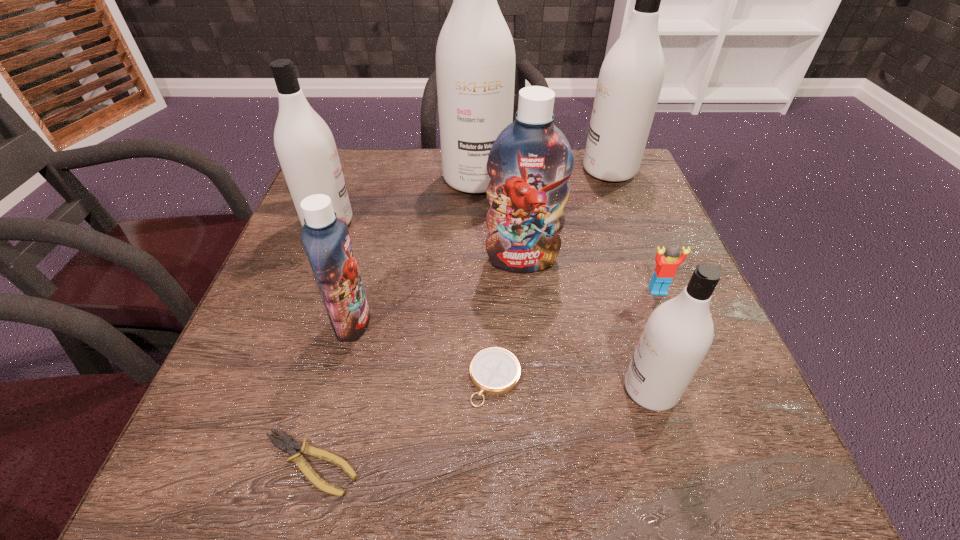
I want to click on free point between the fourth nearest shampoo and the second biggest white shampoo, so click(468, 197).

Locate an element on the screen. The width and height of the screenshot is (960, 540). free spot between the shortest object and the nearest white shampoo is located at coordinates (480, 426).

This screenshot has width=960, height=540. In order to click on unoccupied area between the fifth shortest shampoo and the yellow pliers in this screenshot , I will do `click(460, 317)`.

The height and width of the screenshot is (540, 960). Identify the location of vacant area between the third shortest object and the sixth nearest object. (589, 275).

Identify the location of free point between the shortest object and the third smallest white shampoo. Image resolution: width=960 pixels, height=540 pixels. (460, 317).

I want to click on free space between the fourth nearest shampoo and the nearest white shampoo, so click(490, 306).

I want to click on free area in between the Lego and the second tallest object, so click(x=634, y=231).

You are a GUI agent. You are given a task and a screenshot of the screen. Output one action in this format:
    pyautogui.click(x=<x>, y=<y>)
    Task: Click on the vacant point located between the Lego and the biggest white shampoo
    The image size is (960, 540).
    Given the screenshot: What is the action you would take?
    pyautogui.click(x=567, y=235)

Locate an element on the screen. The image size is (960, 540). vacant area between the second tallest object and the farther blue shampoo is located at coordinates (565, 215).

This screenshot has width=960, height=540. Find the location of `free space between the third white shampoo from right to left and the compass`. free space between the third white shampoo from right to left and the compass is located at coordinates (486, 279).